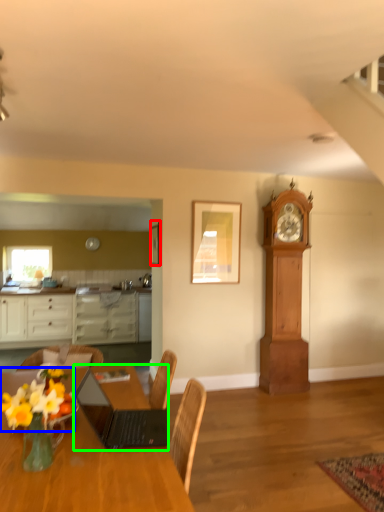
Question: Which object is positioned closest to picture frame (highlighted by a red box)? Select from flower (highlighted by a blue box) and laptop (highlighted by a green box).

Choices:
 (A) flower
 (B) laptop

Answer: (B)